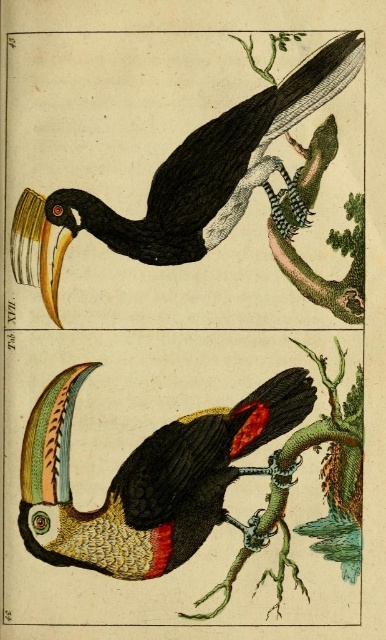
Does matte black toucan at upper center have a lesser width compared to green textured branch at lower center?

No, matte black toucan at upper center is not thinner than green textured branch at lower center.

Where is `matte black toucan at upper center`? matte black toucan at upper center is located at coordinates (208, 189).

Who is positioned more to the left, multicolored feathered toucan at center or green textured branch at lower center?

Positioned to the left is multicolored feathered toucan at center.

Does point (45, 490) come behind point (345, 579)?

Yes, it is behind point (345, 579).

The width and height of the screenshot is (386, 640). Identify the location of multicolored feathered toucan at center. (147, 477).

Does matte black toucan at upper center appear over multicolored feathered toucan at center?

Correct, matte black toucan at upper center is located above multicolored feathered toucan at center.

Is point (23, 192) in front of point (199, 428)?

Yes, it is in front of point (199, 428).

The image size is (386, 640). Identify the location of matte black toucan at upper center. (208, 189).